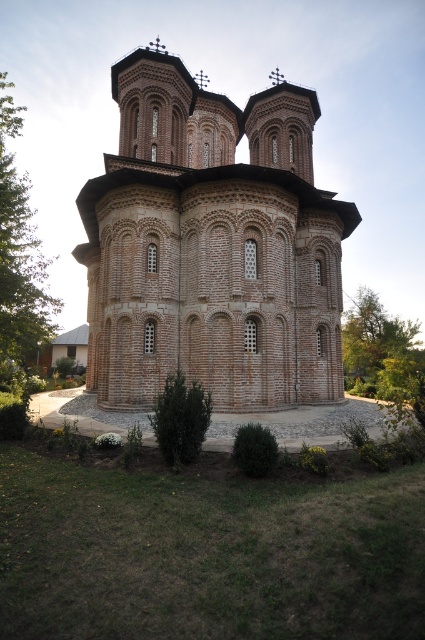
You are standing in front of the historic brick church and want to take a photo that includes both the green leafy tree at left and the green leafy tree at right. Which tree should you position closer to the center of the frame to ensure both are visible?

You should position the green leafy tree at left closer to the center of the frame because it is to the left of the green leafy tree at right, so centering the left tree would help include both in the photo.

You are standing at the entrance of the historic brick church and looking towards the two points marked in the image. Which point, point (169,266) or point (388,381), is closer to you?

Point (169,266) is closer to the viewer than point (388,381).